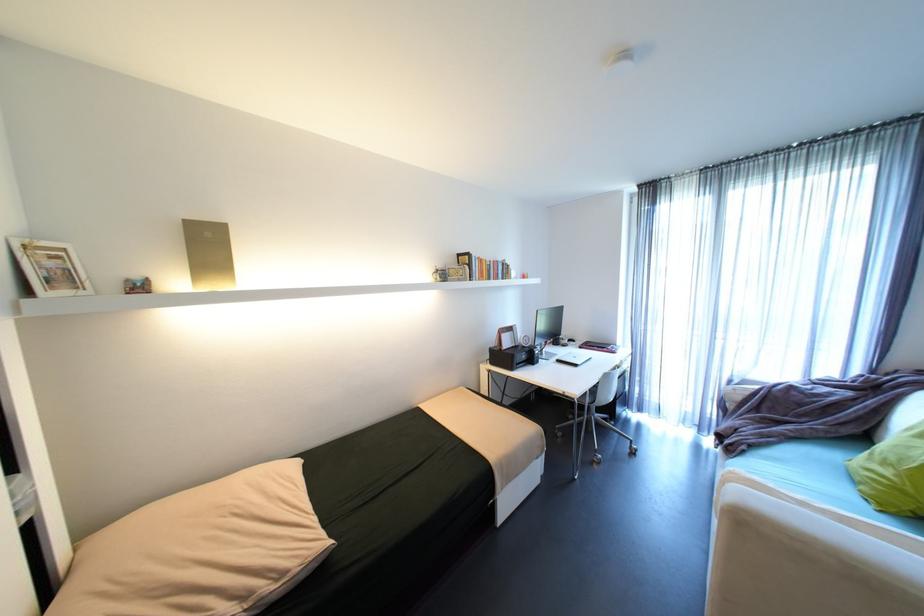
Find where to lift the tan pillow. Please return your answer as a coordinate pair (x, y).

(201, 549)